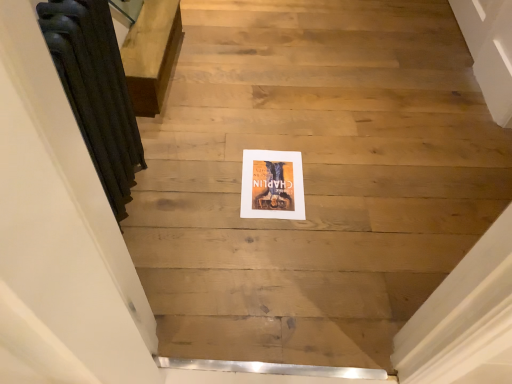
Question: From a real-world perspective, is white matte picture frame at center positioned above or below dark gray cast iron radiator at left?

Choices:
 (A) below
 (B) above

Answer: (A)

Question: In terms of height, does white matte picture frame at center look taller or shorter compared to dark gray cast iron radiator at left?

Choices:
 (A) tall
 (B) short

Answer: (B)

Question: In the image, is white matte picture frame at center on the left side or the right side of dark gray cast iron radiator at left?

Choices:
 (A) right
 (B) left

Answer: (A)

Question: Considering the positions of point (84, 91) and point (266, 208), is point (84, 91) closer or farther from the camera than point (266, 208)?

Choices:
 (A) farther
 (B) closer

Answer: (B)

Question: From the image's perspective, is dark gray cast iron radiator at left above or below white matte picture frame at center?

Choices:
 (A) above
 (B) below

Answer: (A)

Question: From a real-world perspective, is dark gray cast iron radiator at left positioned above or below white matte picture frame at center?

Choices:
 (A) below
 (B) above

Answer: (B)

Question: Based on their sizes in the image, would you say dark gray cast iron radiator at left is bigger or smaller than white matte picture frame at center?

Choices:
 (A) big
 (B) small

Answer: (A)